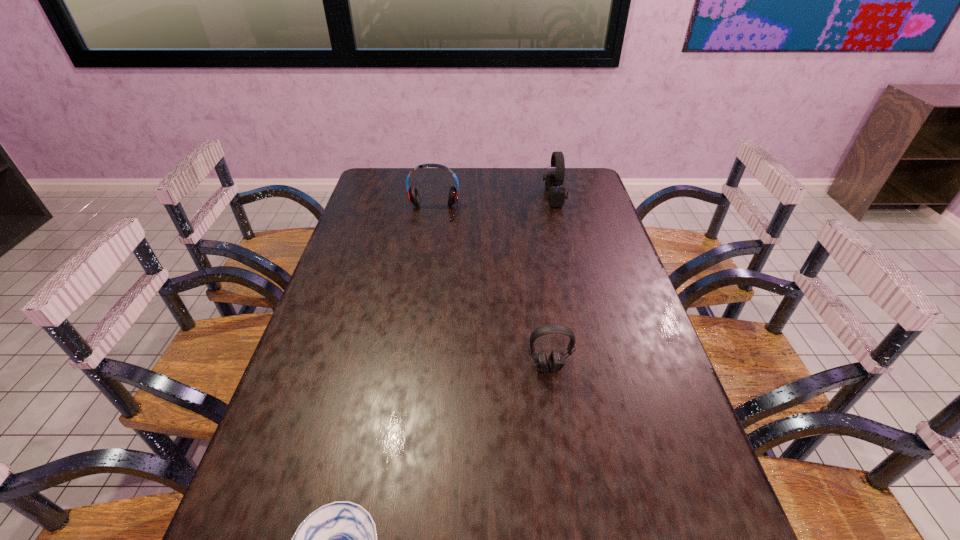
Find the location of a particular element. the rightmost object is located at coordinates (556, 195).

Identify the location of the leftmost headset. Image resolution: width=960 pixels, height=540 pixels. (413, 195).

Locate an element on the screen. This screenshot has width=960, height=540. the third object from left to right is located at coordinates (556, 363).

In order to click on the nearest headset in this screenshot , I will do (x=556, y=363).

Where is `blank area located on the headband of the rightmost object`? This screenshot has width=960, height=540. blank area located on the headband of the rightmost object is located at coordinates (472, 198).

Where is `free space located on the headband of the rightmost object`? free space located on the headband of the rightmost object is located at coordinates (444, 198).

The width and height of the screenshot is (960, 540). Find the location of `vacant space situated 0.250m on the headband of the rightmost object`. vacant space situated 0.250m on the headband of the rightmost object is located at coordinates (478, 198).

Where is `vacant space situated with the microphone attached to the side of the leftmost headset`? The height and width of the screenshot is (540, 960). vacant space situated with the microphone attached to the side of the leftmost headset is located at coordinates (420, 297).

Image resolution: width=960 pixels, height=540 pixels. I want to click on free space located 0.260m on the front-facing side of the nearest headset, so click(565, 485).

What are the coordinates of `object at the far edge` in the screenshot? It's located at (556, 195).